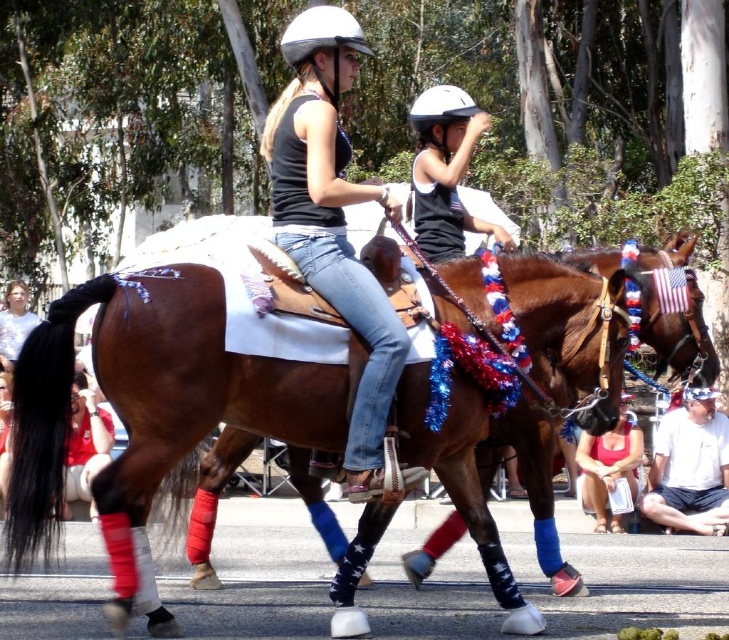
Is brown leather saddle at center below matte black helmet at center?

Indeed, brown leather saddle at center is positioned under matte black helmet at center.

The image size is (729, 640). Find the location of `brown leather saddle at center`. brown leather saddle at center is located at coordinates (148, 404).

You are a GUI agent. You are given a task and a screenshot of the screen. Output one action in this format:
    pyautogui.click(x=<x>, y=<y>)
    Task: Click on the brown leather saddle at center
    The width and height of the screenshot is (729, 640).
    Given the screenshot: What is the action you would take?
    tap(148, 404)

Based on the photo, does matte black helmet at center come in front of matte pink tank top at lower center?

That is True.

Can you confirm if matte black helmet at center is wider than matte pink tank top at lower center?

Indeed, matte black helmet at center has a greater width compared to matte pink tank top at lower center.

Between point (391, 340) and point (593, 461), which one is positioned in front?

Positioned in front is point (391, 340).

Identify the location of matte black helmet at center. point(332,221).

Image resolution: width=729 pixels, height=640 pixels. I want to click on matte black helmet at center, so click(x=332, y=221).

In the scene shown: Does matte black helmet at center appear on the right side of light brown hair at center?

Yes, matte black helmet at center is to the right of light brown hair at center.

The image size is (729, 640). Find the location of `matte black helmet at center`. matte black helmet at center is located at coordinates (332, 221).